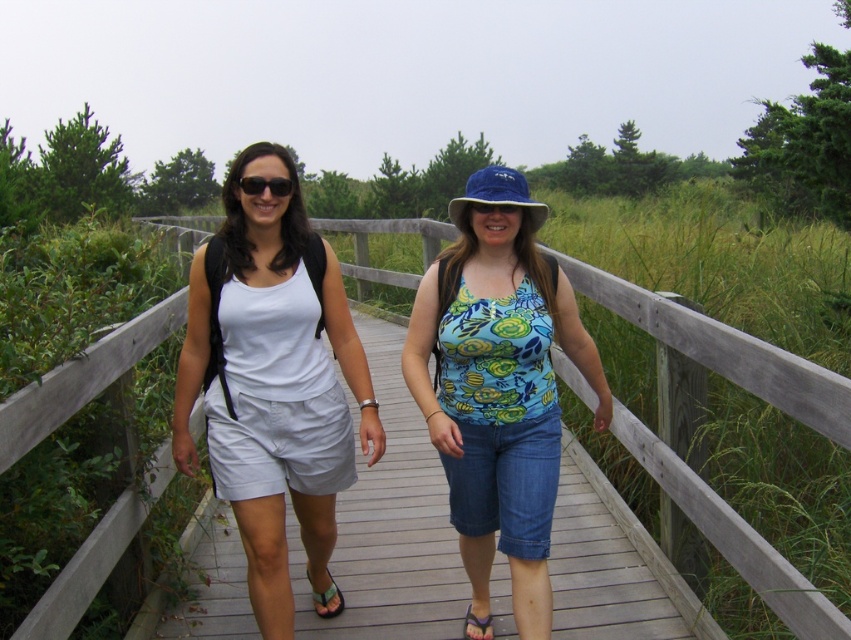
You are standing on the boardwalk and see the blue printed tank top at center and the green fabric sandal at lower center. Which object is positioned more to the right side?

The blue printed tank top at center is positioned more to the right side than the green fabric sandal at lower center.

You are standing at point (260, 188) and want to walk to point (797, 604) along the boardwalk. Which direction should you face to reach your destination?

You should face forward towards point (797, 604) because it is in front of point (260, 188).